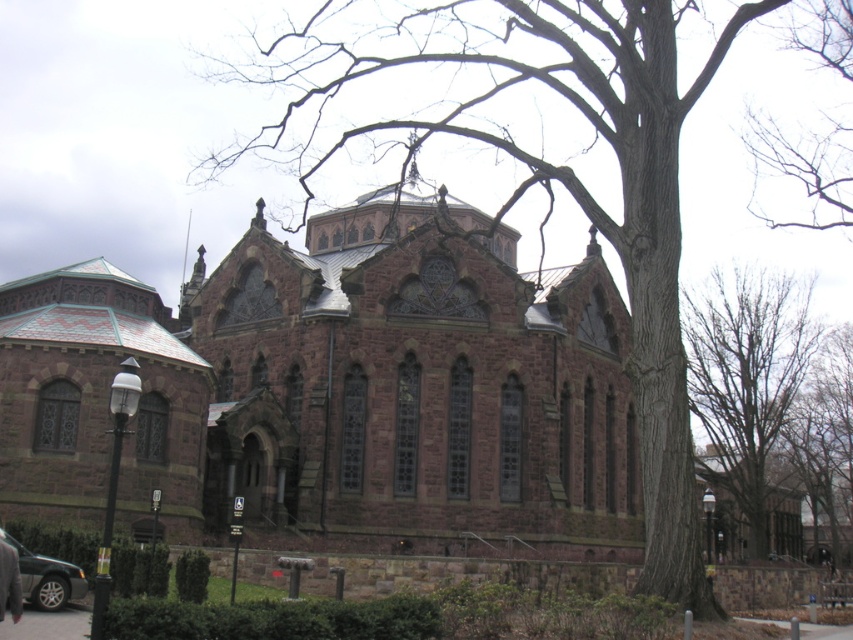
You are a photographer planning to take a picture of the brown stone church at center. You notice a matte black sedan at lower left in the scene. Will the sedan block your view of the church?

The matte black sedan at lower left is behind the brown stone church at center, so it will not block your view of the church.

You are an architect planning to install a new lighting system for the brown stone church at center and the bare branches at upper center. The lights must be spaced exactly 50 meters apart. Can you place them between these two objects without exceeding the required distance?

The distance between the brown stone church at center and the bare branches at upper center is 54.48 meters. Since the required spacing is 50 meters, placing the lights between them would exceed the maximum allowed distance of 50 meters. Therefore, the spacing requirement cannot be met.

From the picture: You are standing in the park and see the brown stone church at center. If you want to take a photo of it from the front, which direction should you face?

Since the brown stone church at center is located at coordinates approximately 0.614 on the x and 0.395 on the y axis, you should position yourself facing the front of the church to capture it in your photo. However, without specific coordinate reference points, the best approach is to align yourself directly in front of the church structure to ensure the main facade is centered in your shot.